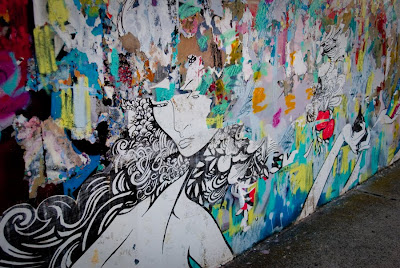
Locate an element on the screen. The height and width of the screenshot is (268, 400). wall is located at coordinates (238, 119).